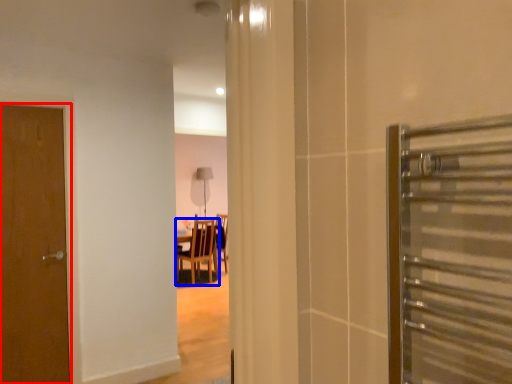
Question: Among these objects, which one is nearest to the camera, door (highlighted by a red box) or chair (highlighted by a blue box)?

Choices:
 (A) door
 (B) chair

Answer: (A)